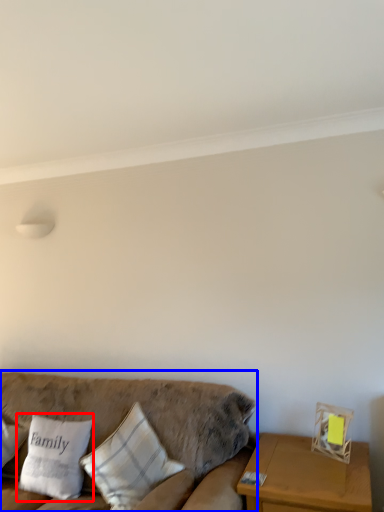
Question: Among these objects, which one is nearest to the camera, pillow (highlighted by a red box) or studio couch (highlighted by a blue box)?

Choices:
 (A) pillow
 (B) studio couch

Answer: (B)